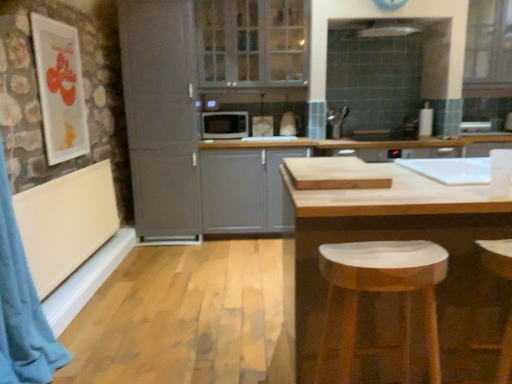
Where is `vacant space in front of matte gray cabinet at center, the second cabinetry from the left`? This screenshot has height=384, width=512. vacant space in front of matte gray cabinet at center, the second cabinetry from the left is located at coordinates (234, 258).